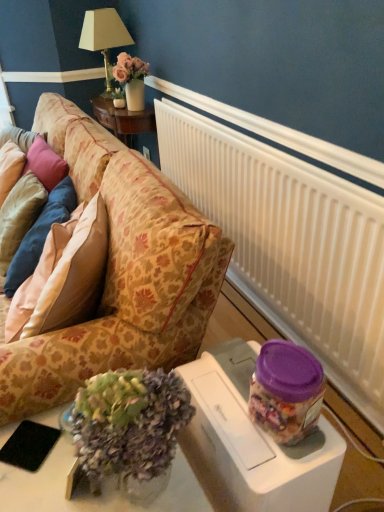
Question: Does pink satin pillow at left, which is counted as the 2th pillow, starting from the right, appear on the right side of pink satin pillow at left, the third pillow viewed from the right?

Choices:
 (A) yes
 (B) no

Answer: (A)

Question: Considering the relative sizes of pink satin pillow at left, which is counted as the 2th pillow, starting from the right, and pink satin pillow at left, which ranks as the 1th pillow in left-to-right order, in the image provided, is pink satin pillow at left, which is counted as the 2th pillow, starting from the right, wider than pink satin pillow at left, which ranks as the 1th pillow in left-to-right order,?

Choices:
 (A) yes
 (B) no

Answer: (A)

Question: Could you tell me if pink satin pillow at left, which is counted as the 2th pillow, starting from the right, is turned towards pink satin pillow at left, the third pillow viewed from the right?

Choices:
 (A) no
 (B) yes

Answer: (B)

Question: Is pink satin pillow at left, the second pillow from the left, next to pink satin pillow at left, which ranks as the 1th pillow in left-to-right order, and touching it?

Choices:
 (A) yes
 (B) no

Answer: (A)

Question: Does pink satin pillow at left, which is counted as the 2th pillow, starting from the right, have a greater height compared to pink satin pillow at left, the third pillow viewed from the right?

Choices:
 (A) yes
 (B) no

Answer: (A)

Question: Can you confirm if pink satin pillow at left, the second pillow from the left, is smaller than pink satin pillow at left, which ranks as the 1th pillow in left-to-right order?

Choices:
 (A) no
 (B) yes

Answer: (A)

Question: From the image's perspective, would you say pink satin pillow at left, the third pillow viewed from the right, is shown under floral-patterned fabric couch at left?

Choices:
 (A) no
 (B) yes

Answer: (A)

Question: Can we say pink satin pillow at left, which ranks as the 1th pillow in left-to-right order, lies outside floral-patterned fabric couch at left?

Choices:
 (A) yes
 (B) no

Answer: (B)

Question: Is pink satin pillow at left, the third pillow viewed from the right, touching floral-patterned fabric couch at left?

Choices:
 (A) no
 (B) yes

Answer: (A)

Question: Is pink satin pillow at left, the third pillow viewed from the right, at the left side of floral-patterned fabric couch at left?

Choices:
 (A) yes
 (B) no

Answer: (A)

Question: Does pink satin pillow at left, the third pillow viewed from the right, have a lesser width compared to floral-patterned fabric couch at left?

Choices:
 (A) no
 (B) yes

Answer: (B)

Question: Does pink satin pillow at left, the third pillow viewed from the right, come in front of floral-patterned fabric couch at left?

Choices:
 (A) no
 (B) yes

Answer: (A)

Question: Can you confirm if white plastic radiator at upper right is shorter than black matte pad at lower left?

Choices:
 (A) yes
 (B) no

Answer: (B)